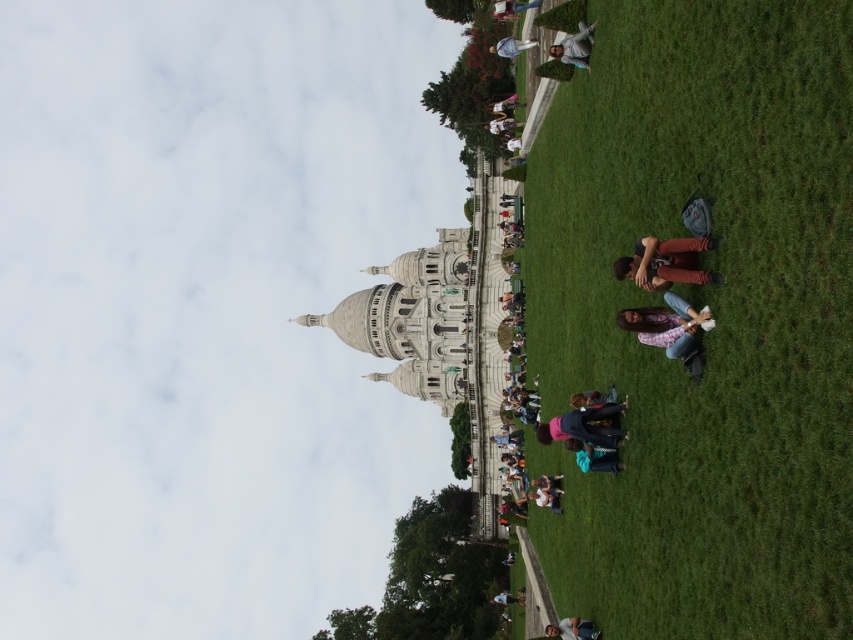
Does floral shirt at lower center appear on the right side of light brown leather jacket at upper center?

Yes, floral shirt at lower center is to the right of light brown leather jacket at upper center.

This screenshot has height=640, width=853. Describe the element at coordinates (665, 324) in the screenshot. I see `floral shirt at lower center` at that location.

The height and width of the screenshot is (640, 853). Find the location of `floral shirt at lower center`. floral shirt at lower center is located at coordinates (665, 324).

Between green grass at lower right and white cotton shirt at center, which one has more height?

green grass at lower right

At what (x,y) coordinates should I click in order to perform the action: click on green grass at lower right. Please return your answer as a coordinate pair (x, y). Looking at the image, I should click on (712, 316).

Where is `green grass at lower right`? The height and width of the screenshot is (640, 853). green grass at lower right is located at coordinates (712, 316).

How distant is light blue denim jeans at upper center from light brown leather jacket at center?

A distance of 5.34 meters exists between light blue denim jeans at upper center and light brown leather jacket at center.

Is point (489, 45) less distant than point (509, 109)?

No, it is not.

The width and height of the screenshot is (853, 640). Identify the location of light blue denim jeans at upper center. coord(511,45).